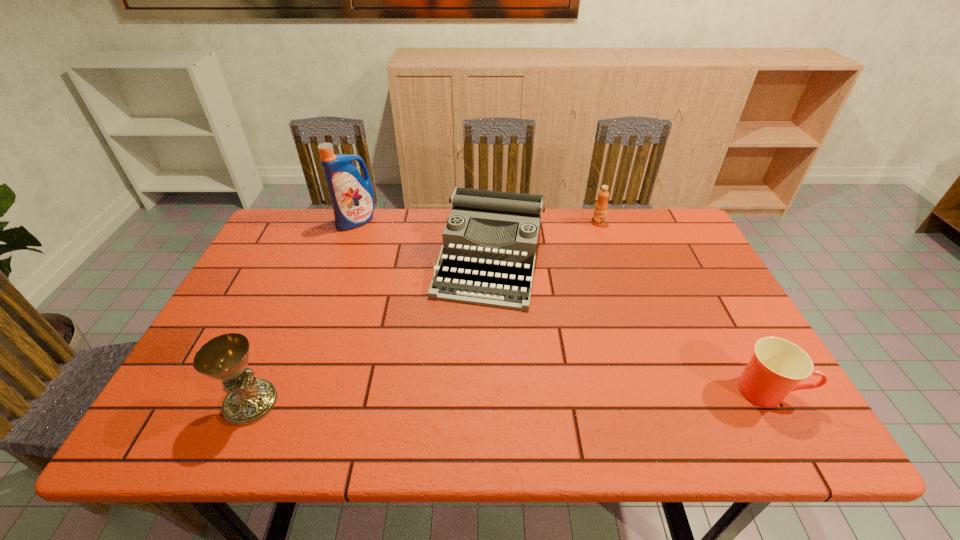
This screenshot has width=960, height=540. What are the coordinates of `vacant space on the desktop that is between the fourth shortest object and the cup and is positioned on the typing side of the typewriter` in the screenshot? It's located at (454, 398).

Find the location of a particular element. This screenshot has width=960, height=540. vacant space on the desktop that is between the fourth shortest object and the rightmost object and is positioned on the label of the tallest object is located at coordinates coord(438,398).

This screenshot has width=960, height=540. I want to click on vacant spot on the desktop that is between the chalice and the rightmost object and is positioned on the front label of the orange juice, so (568, 395).